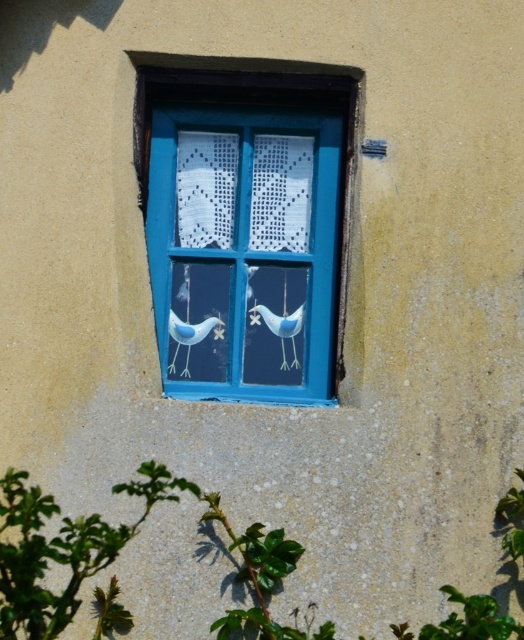
You are an interior designer observing the window with blue painted wood at center and blue matte bird at center. Which object is located more to the left side?

The blue painted wood at center is positioned on the left side of blue matte bird at center, so it is more to the left.

You are an architect designing a new building. You want to ensure that the blue painted wood at center and the white matte bird at center are visible from a distance. Which object will appear wider when viewed from afar?

The blue painted wood at center will appear wider than the white matte bird at center because its width surpasses the bird.

You are a window cleaner who needs to clean both the blue matte bird at center and the white matte bird at center. If your cleaning cloth is 10 centimeters wide, can you cover both birds with a single cloth without moving it?

The distance between the blue matte bird at center and the white matte bird at center is 10.45 centimeters. Since the cloth is only 10 centimeters wide, it cannot fully cover both birds at the same time without moving it.